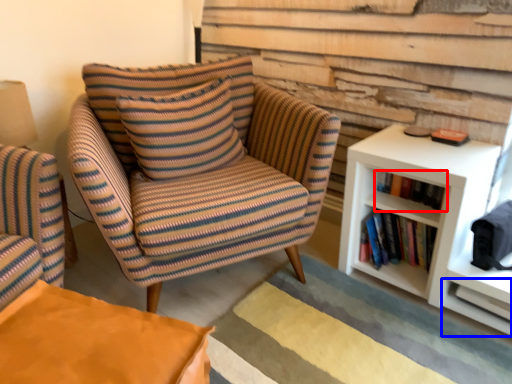
Question: Which of the following is the farthest to the observer, book (highlighted by a red box) or shelf (highlighted by a blue box)?

Choices:
 (A) book
 (B) shelf

Answer: (A)